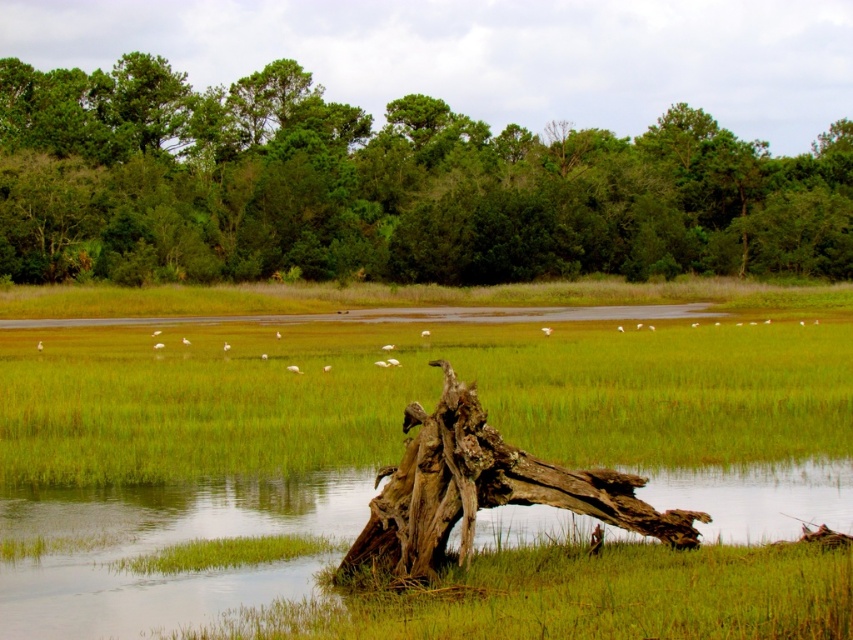
Question: Which object appears closest to the camera in this image?

Choices:
 (A) translucent water at center
 (B) green leafy tree at upper center
 (C) green grass at center
 (D) brown rough wood at center

Answer: (A)

Question: Estimate the real-world distances between objects in this image. Which object is closer to the brown rough wood at center?

Choices:
 (A) translucent water at center
 (B) green grass at center

Answer: (A)

Question: Which of the following is the closest to the observer?

Choices:
 (A) (254, 381)
 (B) (83, 532)
 (C) (515, 451)
 (D) (198, 129)

Answer: (C)

Question: Can you confirm if translucent water at center is smaller than brown rough wood at center?

Choices:
 (A) no
 (B) yes

Answer: (A)

Question: Does green grass at center have a smaller size compared to translucent water at center?

Choices:
 (A) no
 (B) yes

Answer: (A)

Question: Is green grass at center to the right of brown rough wood at center from the viewer's perspective?

Choices:
 (A) yes
 (B) no

Answer: (B)